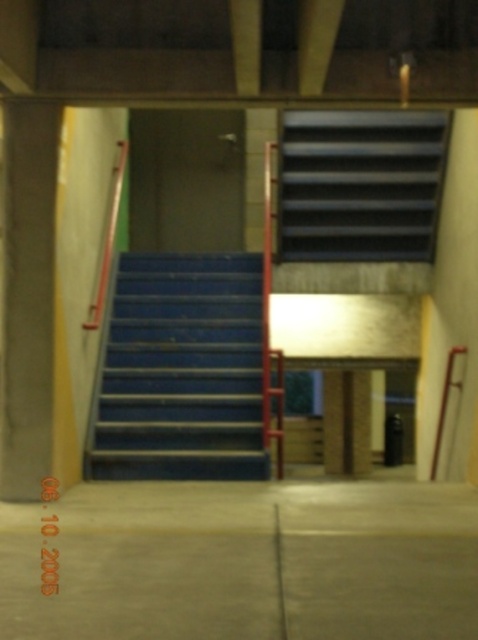
You are standing at the bottom of the blue rubber stairs at upper center and want to climb up to the metallic silver ladder at right. Which object will you encounter first as you move upward?

You will encounter the blue rubber stairs at upper center first because it is closer to you than the metallic silver ladder at right, which is further away.

You are standing at the bottom of the staircase and want to step onto the blue painted metal stairs at center. Is the point at coordinates (182, 371) on the stairs?

Yes, the point at coordinates (182, 371) is on the blue painted metal stairs at center, so you can step onto the stairs at that location.

You are standing at the bottom of the blue rubber stairs at upper center and want to reach the metallic silver ladder at right. Which direction should you move to get closer to the ladder?

The blue rubber stairs at upper center is located above the metallic silver ladder at right, so to reach the ladder, you should move downward towards the bottom of the stairs.